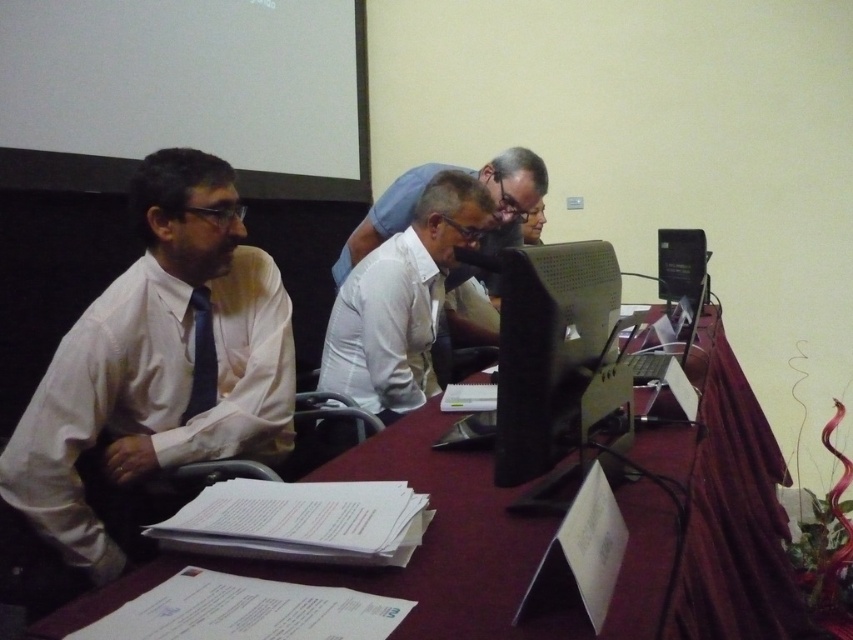
How far apart are the two people closest to the black plastic monitor at center?

The two people closest to the black plastic monitor at center are 3.29 feet apart.

You are standing in the conference room and see the point marked at coordinates (512, 330). Is this point within arm reach from where you are standing?

The point at coordinates (512, 330) is 1.02 meters away from the viewer. Since the average arm reach is about 1 meter, the point is slightly out of arm reach.